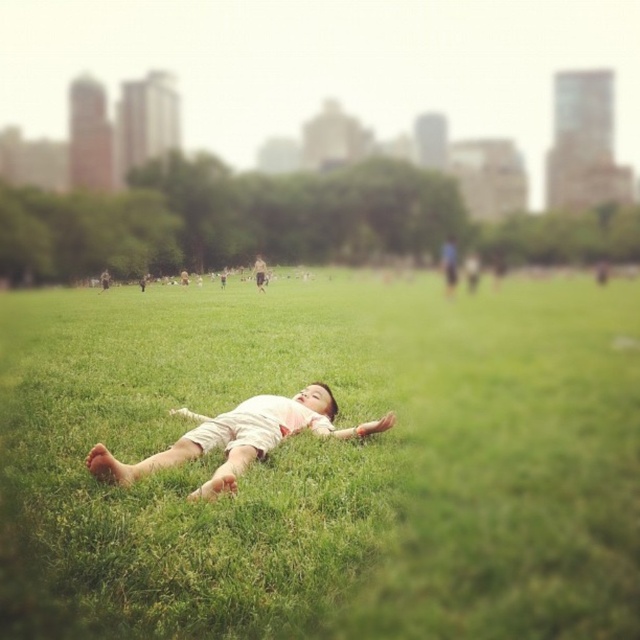
Question: Which is nearer to the green grass at center?

Choices:
 (A) light brown leather jacket at center
 (B) light pink cotton shirt at center

Answer: (B)

Question: Is green grass at center above light pink cotton shirt at center?

Choices:
 (A) yes
 (B) no

Answer: (A)

Question: Which point is closer to the camera taking this photo?

Choices:
 (A) (392, 419)
 (B) (170, 396)

Answer: (A)

Question: Where is green grass at center located in relation to light pink cotton shirt at center in the image?

Choices:
 (A) right
 (B) left

Answer: (B)

Question: Among these objects, which one is farthest from the camera?

Choices:
 (A) light pink cotton shirt at center
 (B) light brown leather jacket at center
 (C) green grass at center

Answer: (B)

Question: Does light pink cotton shirt at center have a larger size compared to light brown leather jacket at center?

Choices:
 (A) no
 (B) yes

Answer: (A)